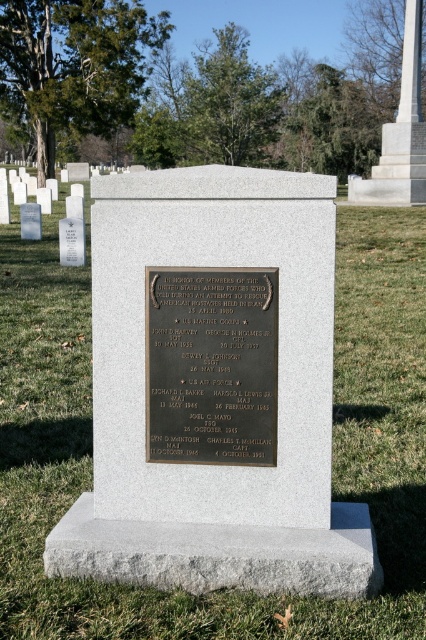
You are a visitor at the memorial and want to take a photo of the bronze plaque at center and the white marble monument at upper right. Which object should you focus on first if you want to include both in the frame without moving your camera? Explain your reasoning based on their sizes.

The bronze plaque at center has a lesser height compared to the white marble monument at upper right. Therefore, to include both in the frame without moving the camera, you should focus on the taller white marble monument at upper right first, as it occupies more vertical space and adjusting the frame for it would naturally include the smaller bronze plaque at center.

You are a groundskeeper at the memorial park. You need to place a new flowerpot that is 1 meter wide between the gray granite gravestone at center and the bronze plaque at center. Can the flowerpot fit between them?

The gray granite gravestone at center might be wider than bronze plaque at center, so the distance between them is uncertain. Therefore, the flowerpot may or may not fit. Check the actual space before placing it.